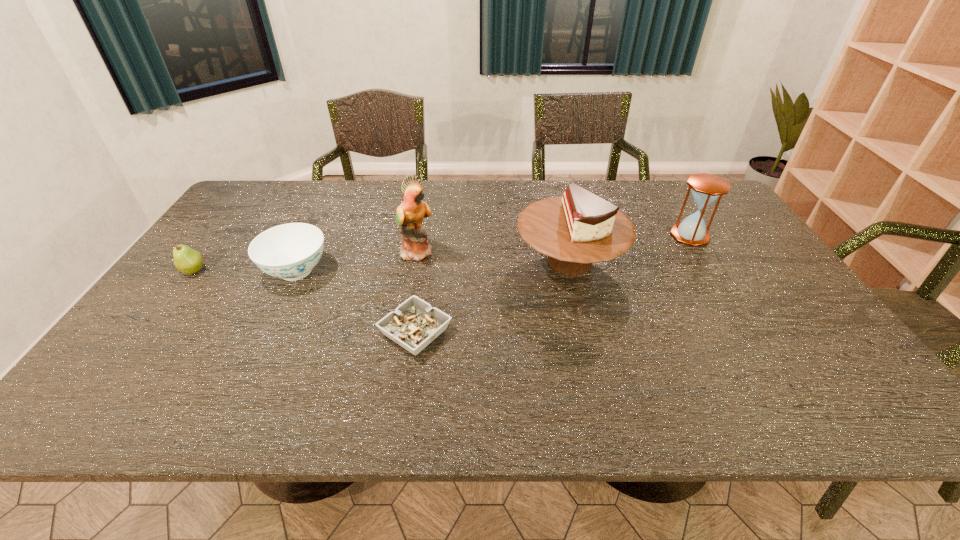
Locate which object is the third closest to the chinaware. Please provide its 2D coordinates. Your answer should be formatted as a tuple, i.e. [(x, y)], where the tuple contains the x and y coordinates of a point satisfying the conditions above.

[(410, 213)]

In order to click on free space that satisfies the following two spatial constraints: 1. on the front-facing side of the tallest object; 2. on the right side of the shortest object in this screenshot , I will do `click(403, 332)`.

Find the location of `vacant position in the image that satisfies the following two spatial constraints: 1. on the front-facing side of the tallest object; 2. on the left side of the ashtray`. vacant position in the image that satisfies the following two spatial constraints: 1. on the front-facing side of the tallest object; 2. on the left side of the ashtray is located at coordinates (403, 332).